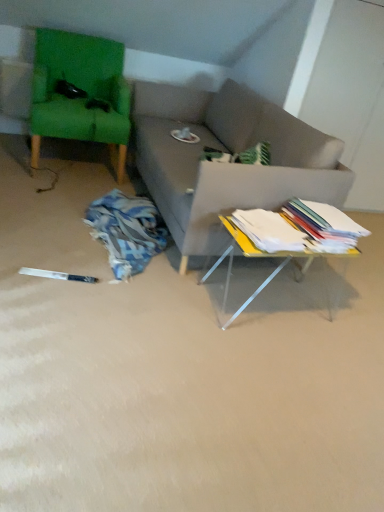
Question: From a real-world perspective, is white paper stack at right, the 2th book when ordered from left to right, above or below green fabric swivel chair at upper left?

Choices:
 (A) below
 (B) above

Answer: (B)

Question: From the image's perspective, is white paper stack at right, the 2th book when ordered from left to right, located above or below green fabric swivel chair at upper left?

Choices:
 (A) below
 (B) above

Answer: (A)

Question: Which object is the farthest from the white paper stack at right, positioned as the 1th book in right-to-left order?

Choices:
 (A) white paper stack at center, arranged as the first book when viewed from the left
 (B) yellow acrylic table at lower right
 (C) green fabric swivel chair at upper left

Answer: (C)

Question: Based on their relative distances, which object is nearer to the white paper stack at right, positioned as the 1th book in right-to-left order?

Choices:
 (A) green fabric swivel chair at upper left
 (B) yellow acrylic table at lower right
 (C) white paper stack at center, which is counted as the second book, starting from the right

Answer: (C)